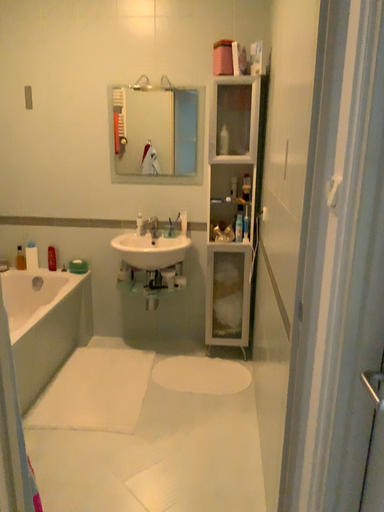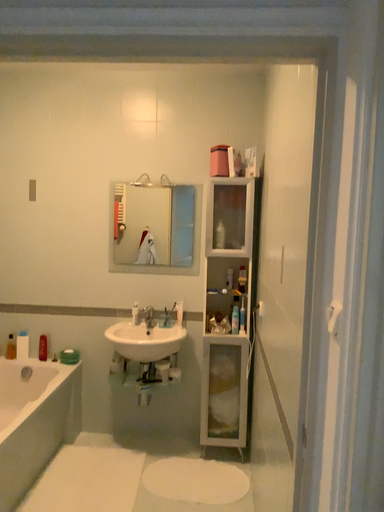
Question: Which way did the camera rotate in the video?

Choices:
 (A) rotated downward
 (B) rotated upward

Answer: (B)